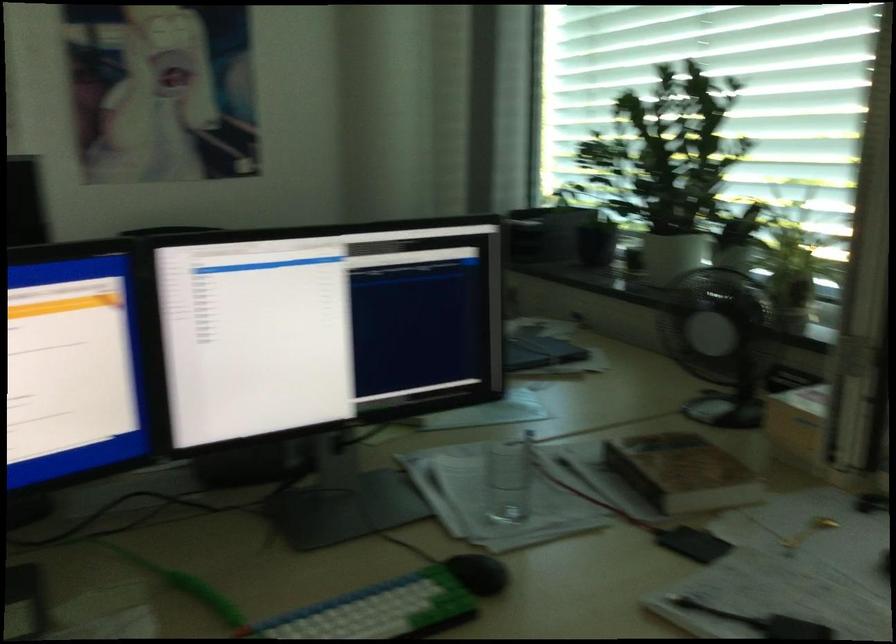
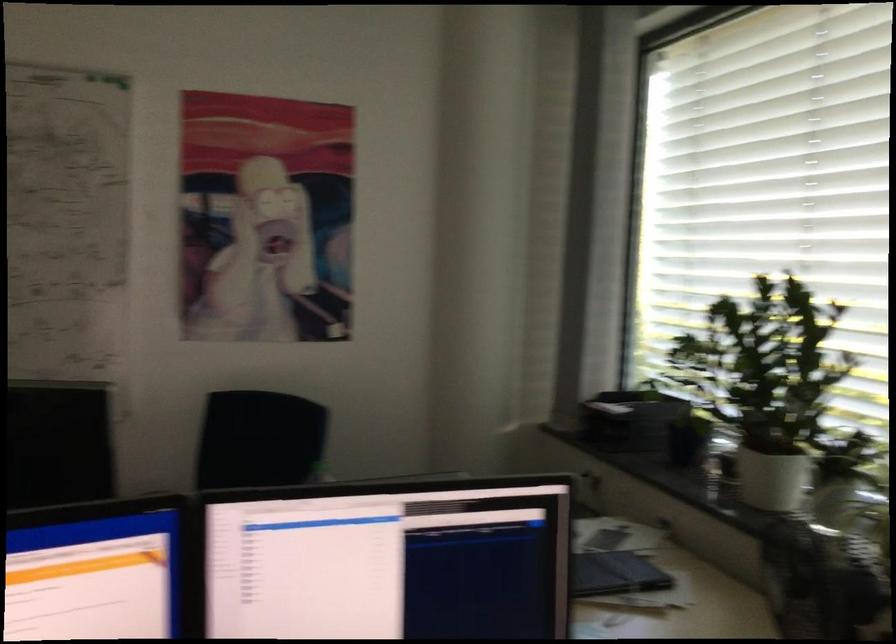
Locate, in the second image, the point that corresponds to point (674, 258) in the first image.

(770, 478)